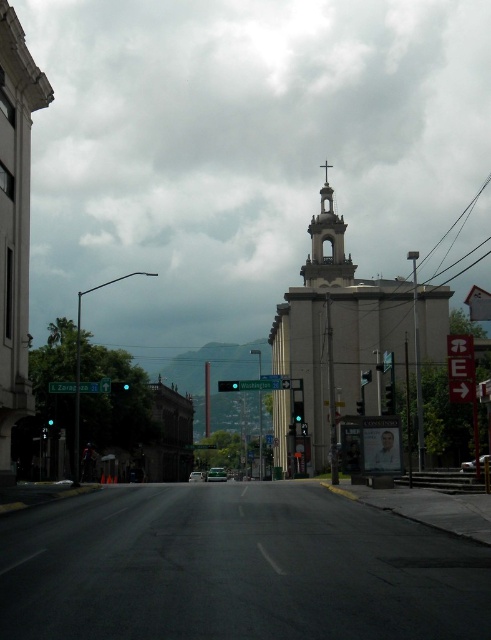
Does white stone church at left appear over smooth stone bell tower at center?

Incorrect, white stone church at left is not positioned above smooth stone bell tower at center.

Is white stone church at left shorter than smooth stone bell tower at center?

Correct, white stone church at left is not as tall as smooth stone bell tower at center.

Identify the location of white stone church at left. This screenshot has height=640, width=491. (15, 224).

Consider the image. Can you confirm if smooth concrete church at center is positioned to the right of white stone church at left?

Yes, smooth concrete church at center is to the right of white stone church at left.

Who is lower down, smooth concrete church at center or white stone church at left?

smooth concrete church at center is below.

Locate an element on the screen. smooth concrete church at center is located at coordinates (343, 337).

How much distance is there between smooth concrete church at center and smooth stone bell tower at center?

smooth concrete church at center is 12.09 meters away from smooth stone bell tower at center.

I want to click on smooth concrete church at center, so click(343, 337).

The width and height of the screenshot is (491, 640). Identify the location of smooth concrete church at center. (343, 337).